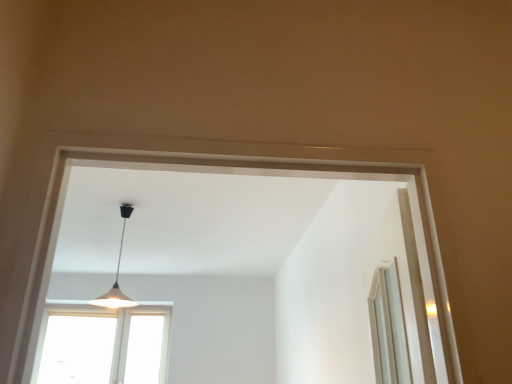
The width and height of the screenshot is (512, 384). Find the location of `white matte lampshade at center`. white matte lampshade at center is located at coordinates (117, 274).

The height and width of the screenshot is (384, 512). Describe the element at coordinates (117, 274) in the screenshot. I see `white matte lampshade at center` at that location.

In order to face white matte lampshade at center, should I rotate leftwards or rightwards?

To align with it, rotate left about 17.471°.

The height and width of the screenshot is (384, 512). Identify the location of transparent glass window at lower left. (103, 344).

Measure the distance between transparent glass window at lower left and camera.

transparent glass window at lower left and camera are 14.52 feet apart from each other.

Describe the element at coordinates (103, 344) in the screenshot. I see `transparent glass window at lower left` at that location.

What is the approximate width of transparent glass window at lower left?

3.36 inches.

Locate an element on the screen. The height and width of the screenshot is (384, 512). white matte lampshade at center is located at coordinates (117, 274).

Considering the positions of objects transparent glass window at lower left and white matte lampshade at center in the image provided, who is more to the left, transparent glass window at lower left or white matte lampshade at center?

transparent glass window at lower left.

Between transparent glass window at lower left and white matte lampshade at center, which one is positioned behind?

transparent glass window at lower left.

Which is nearer, (131, 376) or (127, 301)?

The point (131, 376) is closer.

From the image's perspective, which object appears higher, transparent glass window at lower left or white matte lampshade at center?

white matte lampshade at center appears higher in the image.

From a real-world perspective, which is physically above, transparent glass window at lower left or white matte lampshade at center?

white matte lampshade at center, from a real-world perspective.

Can you confirm if transparent glass window at lower left is thinner than white matte lampshade at center?

Yes, transparent glass window at lower left is thinner than white matte lampshade at center.

Is transparent glass window at lower left taller than white matte lampshade at center?

Correct, transparent glass window at lower left is much taller as white matte lampshade at center.

Who is bigger, transparent glass window at lower left or white matte lampshade at center?

Bigger between the two is transparent glass window at lower left.

Is transparent glass window at lower left inside or outside of white matte lampshade at center?

The correct answer is: outside.

Is transparent glass window at lower left touching white matte lampshade at center?

No, transparent glass window at lower left is not with white matte lampshade at center.

Could you tell me if transparent glass window at lower left is facing white matte lampshade at center?

Yes, transparent glass window at lower left is facing white matte lampshade at center.

Can you tell me how much transparent glass window at lower left and white matte lampshade at center differ in facing direction?

1.28 degrees.

How distant is transparent glass window at lower left from white matte lampshade at center?

The distance of transparent glass window at lower left from white matte lampshade at center is 17.59 inches.

At what (x,y) coordinates should I click in order to perform the action: click on window located underneath the white matte lampshade at center (from a real-world perspective). Please return your answer as a coordinate pair (x, y). Looking at the image, I should click on (103, 344).

Considering the relative positions of white matte lampshade at center and transparent glass window at lower left in the image provided, is white matte lampshade at center to the left of transparent glass window at lower left from the viewer's perspective?

Incorrect, white matte lampshade at center is not on the left side of transparent glass window at lower left.

Is white matte lampshade at center in front of or behind transparent glass window at lower left in the image?

In the image, white matte lampshade at center appears in front of transparent glass window at lower left.

Which point is more forward, (x=106, y=305) or (x=89, y=306)?

The point (x=106, y=305) is closer to the camera.

From the image's perspective, which one is positioned higher, white matte lampshade at center or transparent glass window at lower left?

From the image's view, white matte lampshade at center is above.

From a real-world perspective, which is physically above, white matte lampshade at center or transparent glass window at lower left?

In real-world perspective, white matte lampshade at center is above.

Considering the sizes of objects white matte lampshade at center and transparent glass window at lower left in the image provided, who is thinner, white matte lampshade at center or transparent glass window at lower left?

With smaller width is transparent glass window at lower left.

Who is taller, white matte lampshade at center or transparent glass window at lower left?

transparent glass window at lower left is taller.

Can you confirm if white matte lampshade at center is smaller than transparent glass window at lower left?

Yes, white matte lampshade at center is smaller than transparent glass window at lower left.

Is transparent glass window at lower left located within white matte lampshade at center?

No, transparent glass window at lower left is not inside white matte lampshade at center.

Consider the image. Is white matte lampshade at center next to transparent glass window at lower left and touching it?

No, white matte lampshade at center is not touching transparent glass window at lower left.

Is white matte lampshade at center aimed at transparent glass window at lower left?

No, white matte lampshade at center is not facing towards transparent glass window at lower left.

What's the angular difference between white matte lampshade at center and transparent glass window at lower left's facing directions?

They differ by 1.28 degrees in their facing directions.

This screenshot has width=512, height=384. What are the coordinates of `lamp located in front of the transparent glass window at lower left` in the screenshot? It's located at (117, 274).

This screenshot has width=512, height=384. Find the location of `window that is below the white matte lampshade at center (from the image's perspective)`. window that is below the white matte lampshade at center (from the image's perspective) is located at coordinates (103, 344).

At what (x,y) coordinates should I click in order to perform the action: click on lamp that appears on the right of transparent glass window at lower left. Please return your answer as a coordinate pair (x, y). Image resolution: width=512 pixels, height=384 pixels. Looking at the image, I should click on (117, 274).